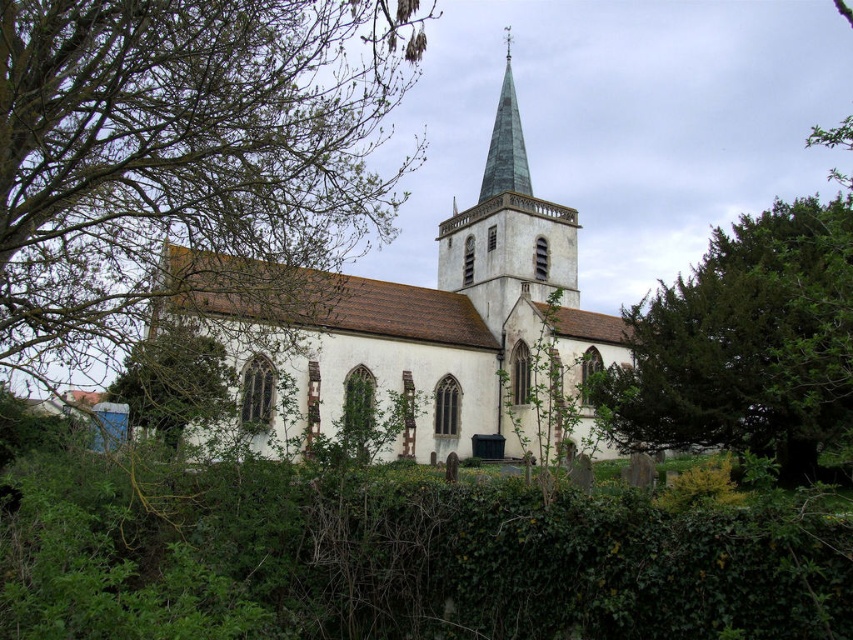
Question: Can you confirm if green leafy tree at upper left is positioned to the left of green glass steeple at upper center?

Choices:
 (A) yes
 (B) no

Answer: (A)

Question: Which point is closer to the camera taking this photo?

Choices:
 (A) (554, 248)
 (B) (401, 26)

Answer: (A)

Question: Does dark green leafy tree at right have a greater width compared to green glass steeple at upper center?

Choices:
 (A) yes
 (B) no

Answer: (A)

Question: Can you confirm if green leafy tree at upper left is wider than white stone church at center?

Choices:
 (A) no
 (B) yes

Answer: (A)

Question: Which is nearer to the green leafy tree at upper left?

Choices:
 (A) white stone church at center
 (B) green glass spire at upper center
 (C) green glass steeple at upper center
 (D) dark green leafy tree at right

Answer: (A)

Question: Among these objects, which one is nearest to the camera?

Choices:
 (A) green glass steeple at upper center
 (B) dark green leafy tree at right

Answer: (B)